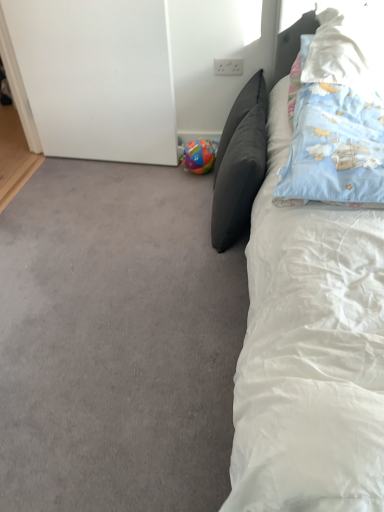
Locate an element on the screen. free spot above gray carpet at lower left (from a real-world perspective) is located at coordinates (109, 262).